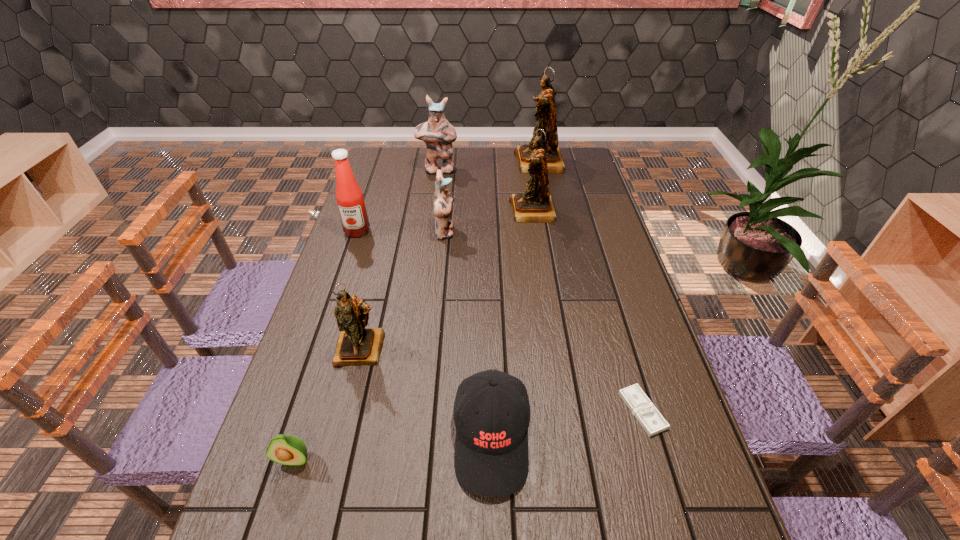
Find the location of a particular element. free space located on the front-facing side of the leftmost gold figurine is located at coordinates (345, 416).

In order to click on free location located on the front of the shortest object in this screenshot , I will do `click(662, 479)`.

Where is `condiment positioned at the left edge`? The image size is (960, 540). condiment positioned at the left edge is located at coordinates (349, 197).

I want to click on figurine that is at the left edge, so click(356, 345).

Where is `avocado located in the left edge section of the desktop`? The image size is (960, 540). avocado located in the left edge section of the desktop is located at coordinates (290, 450).

Identify the location of figurine that is at the right edge. (546, 117).

At what (x,y) coordinates should I click in order to perform the action: click on money present at the right edge. Please return your answer as a coordinate pair (x, y). The image size is (960, 540). Looking at the image, I should click on (651, 420).

Find the location of a particular element. The height and width of the screenshot is (540, 960). object situated at the far right corner is located at coordinates (546, 117).

At what (x,y) coordinates should I click in order to perform the action: click on vacant area at the left edge. Please return your answer as a coordinate pair (x, y). The height and width of the screenshot is (540, 960). Looking at the image, I should click on (256, 473).

In the image, there is a desktop. At what (x,y) coordinates should I click in order to perform the action: click on vacant region at the right edge. Please return your answer as a coordinate pair (x, y). This screenshot has width=960, height=540. Looking at the image, I should click on (603, 382).